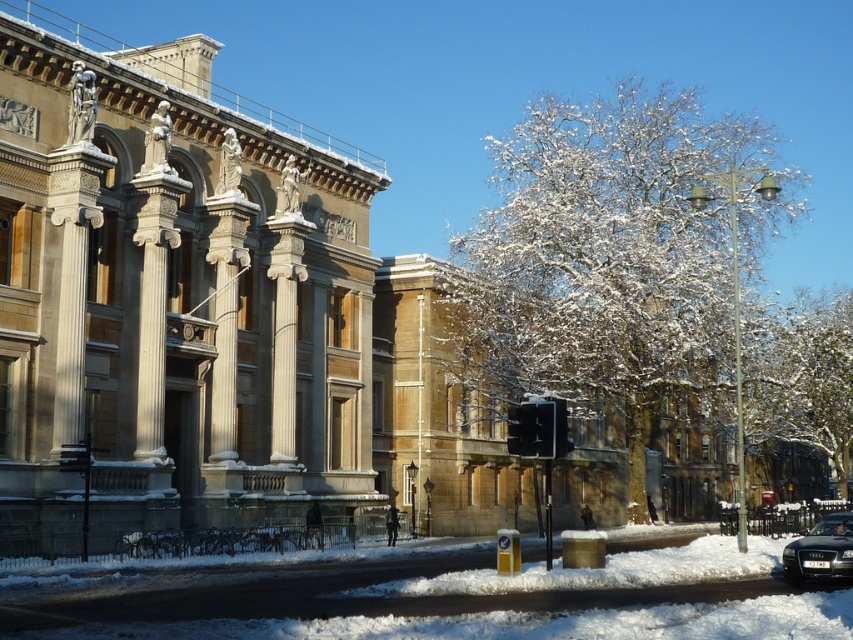
You are standing in front of the grand classical building and want to take a photo. You notice two points marked in the scene. The first point is at coordinate point (599, 376) and the second is at point (801, 547). Which point is closer to your camera lens?

Point (599, 376) is further to the camera than point (801, 547). Therefore, point (801, 547) is closer to your camera lens.

You are standing in front of the classical building and looking at two points on the snowy ground. The first point is located at coordinate point (x=805, y=317) and the second at point (x=787, y=556). Which point is closer to your current position?

Point (x=787, y=556) is closer to your current position because it is less further to the camera than point (x=805, y=317).